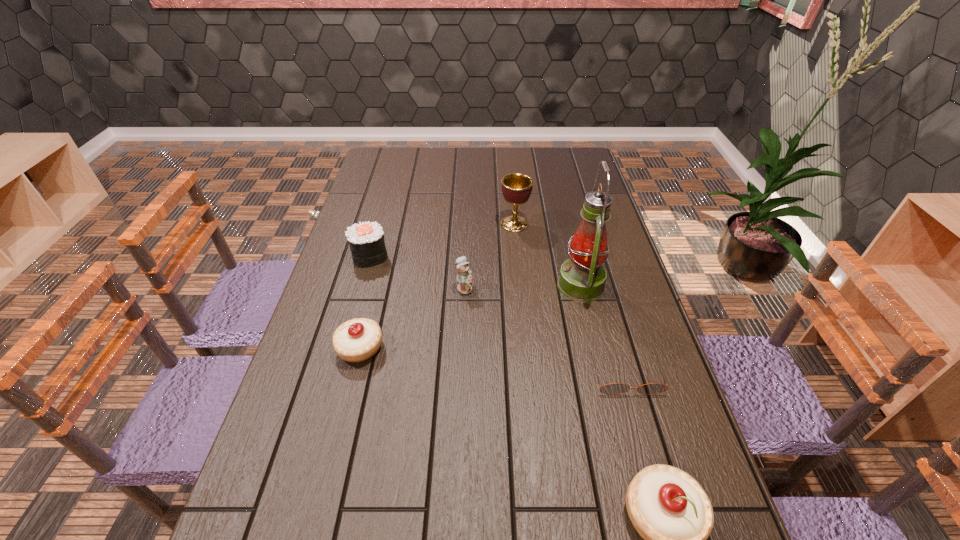
Please mark a free spot for a new pastry to balance the arrangement. Please provide its 2D coordinates. Your answer should be formatted as a tuple, i.e. [(x, y)], where the tuple contains the x and y coordinates of a point satisfying the conditions above.

[(489, 420)]